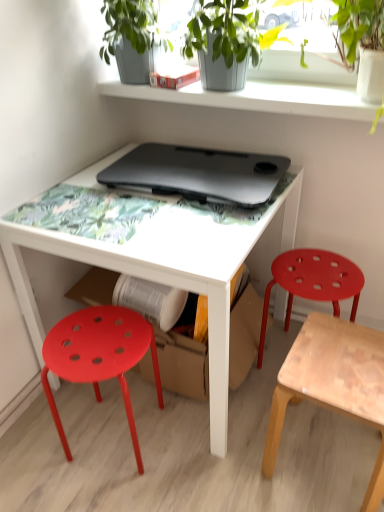
Question: From a real-world perspective, is light brown wooden stool at lower right, marked as the 2th stool in a left-to-right arrangement, below matte plastic stool at lower left, which ranks as the 3th stool in right-to-left order?

Choices:
 (A) no
 (B) yes

Answer: (B)

Question: Can you confirm if light brown wooden stool at lower right, marked as the 2th stool in a left-to-right arrangement, is positioned to the left of matte plastic stool at lower left, the 1th stool from the left?

Choices:
 (A) no
 (B) yes

Answer: (A)

Question: Is the surface of light brown wooden stool at lower right, which appears as the second stool when viewed from the right, in direct contact with matte plastic stool at lower left, the 1th stool from the left?

Choices:
 (A) yes
 (B) no

Answer: (B)

Question: Can you confirm if light brown wooden stool at lower right, which appears as the second stool when viewed from the right, is taller than matte plastic stool at lower left, the 1th stool from the left?

Choices:
 (A) no
 (B) yes

Answer: (A)

Question: Is there a large distance between light brown wooden stool at lower right, which appears as the second stool when viewed from the right, and matte plastic stool at lower left, which ranks as the 3th stool in right-to-left order?

Choices:
 (A) yes
 (B) no

Answer: (B)

Question: Is light brown wooden stool at lower right, which appears as the second stool when viewed from the right, at the right side of matte plastic stool at lower left, which ranks as the 3th stool in right-to-left order?

Choices:
 (A) no
 (B) yes

Answer: (B)

Question: Is matte plastic stool at lower left, the 1th stool from the left, at the right side of matte plastic stool at right, the 1th stool positioned from the right?

Choices:
 (A) yes
 (B) no

Answer: (B)

Question: Is matte plastic stool at lower left, the 1th stool from the left, positioned behind matte plastic stool at right, which is the 3th stool from left to right?

Choices:
 (A) yes
 (B) no

Answer: (B)

Question: From the image's perspective, does matte plastic stool at lower left, the 1th stool from the left, appear higher than matte plastic stool at right, the 1th stool positioned from the right?

Choices:
 (A) yes
 (B) no

Answer: (B)

Question: Is matte plastic stool at lower left, the 1th stool from the left, at the left side of matte plastic stool at right, the 1th stool positioned from the right?

Choices:
 (A) yes
 (B) no

Answer: (A)

Question: From a real-world perspective, is matte plastic stool at lower left, which ranks as the 3th stool in right-to-left order, over matte plastic stool at right, the 1th stool positioned from the right?

Choices:
 (A) yes
 (B) no

Answer: (A)

Question: From a real-world perspective, is matte plastic stool at lower left, the 1th stool from the left, below matte plastic stool at right, which is the 3th stool from left to right?

Choices:
 (A) no
 (B) yes

Answer: (A)

Question: Is smooth gray concrete shelf at upper center facing towards matte plastic stool at right, the 1th stool positioned from the right?

Choices:
 (A) no
 (B) yes

Answer: (A)